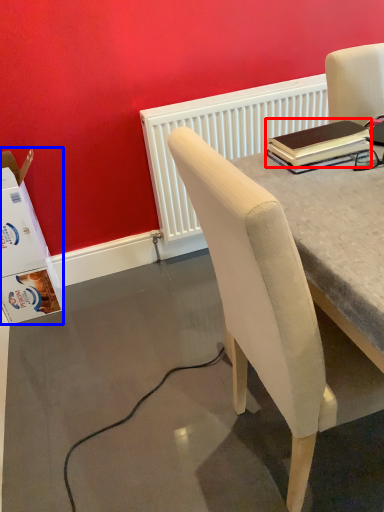
Question: Which point is further to the camera, notebook (highlighted by a red box) or box (highlighted by a blue box)?

Choices:
 (A) notebook
 (B) box

Answer: (B)